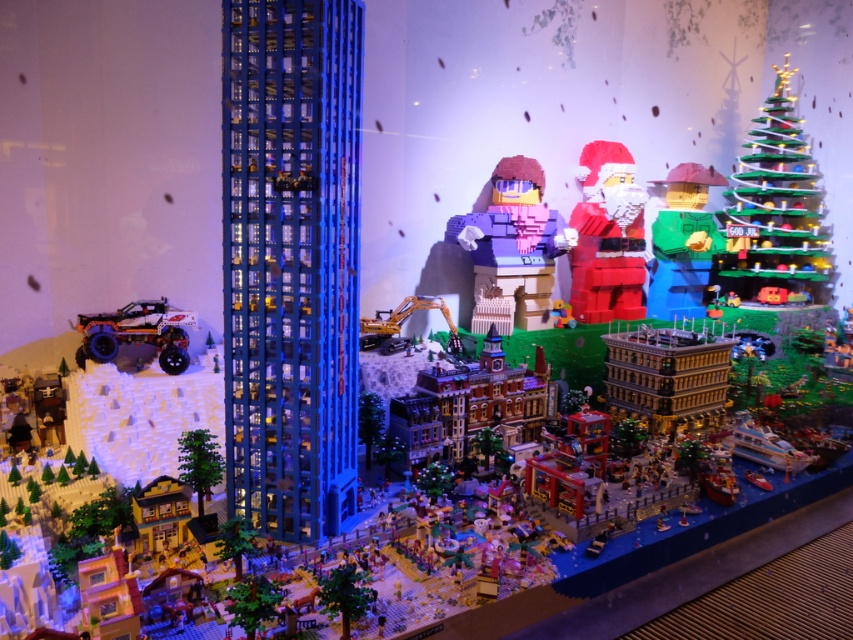
Question: Is matte pink plastic minifigure at center positioned in front of green matte christmas tree at lower left?

Choices:
 (A) no
 (B) yes

Answer: (A)

Question: Which object is closer to the camera taking this photo?

Choices:
 (A) metallic yellow excavator at center
 (B) brick-patterned building at center

Answer: (B)

Question: Does shiny metallic car at left come behind metallic yellow excavator at center?

Choices:
 (A) yes
 (B) no

Answer: (B)

Question: Among these points, which one is nearest to the camera?

Choices:
 (A) (410, 305)
 (B) (161, 362)

Answer: (B)

Question: Does matte red santa at center have a lesser width compared to shiny metallic car at left?

Choices:
 (A) no
 (B) yes

Answer: (A)

Question: Which object appears closest to the camera in this image?

Choices:
 (A) green matte christmas tree at lower left
 (B) green matte figure at center-right

Answer: (A)